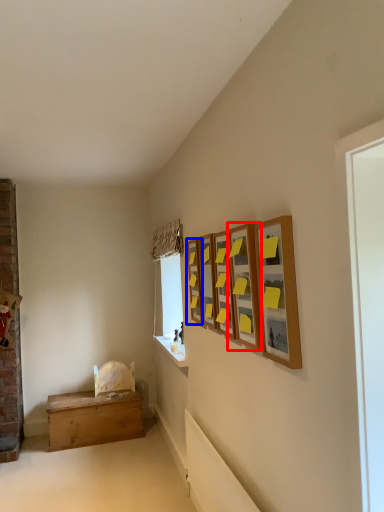
Question: Which of the following is the farthest to the observer, picture frame (highlighted by a red box) or picture frame (highlighted by a blue box)?

Choices:
 (A) picture frame
 (B) picture frame

Answer: (B)